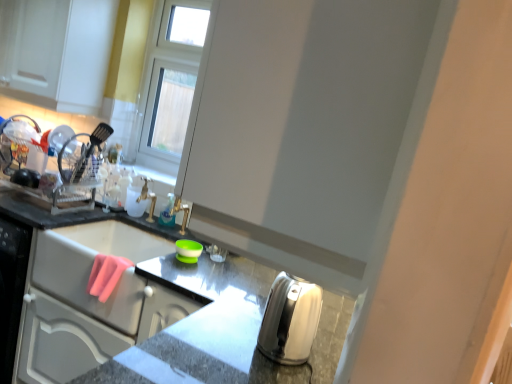
Question: Could you tell me if satin silver kettle at lower right, positioned as the 2th appliance in back-to-front order, is turned towards translucent plastic bottle at center?

Choices:
 (A) yes
 (B) no

Answer: (B)

Question: Is satin silver kettle at lower right, the 2th appliance from the left, further to the viewer compared to translucent plastic bottle at center?

Choices:
 (A) no
 (B) yes

Answer: (A)

Question: Is satin silver kettle at lower right, positioned as the 2th appliance in back-to-front order, shorter than translucent plastic bottle at center?

Choices:
 (A) no
 (B) yes

Answer: (A)

Question: Is satin silver kettle at lower right, the 2th appliance from the left, at the left side of translucent plastic bottle at center?

Choices:
 (A) yes
 (B) no

Answer: (B)

Question: Is satin silver kettle at lower right, the first appliance when ordered from front to back, with translucent plastic bottle at center?

Choices:
 (A) yes
 (B) no

Answer: (B)

Question: In the image, is translucent plastic bottle at center on the left side or the right side of white glossy sink at upper left?

Choices:
 (A) left
 (B) right

Answer: (B)

Question: Would you say translucent plastic bottle at center is inside or outside white glossy sink at upper left?

Choices:
 (A) inside
 (B) outside

Answer: (A)

Question: Considering the positions of point (170, 205) and point (135, 236), is point (170, 205) closer or farther from the camera than point (135, 236)?

Choices:
 (A) closer
 (B) farther

Answer: (B)

Question: From a real-world perspective, relative to white glossy sink at upper left, is translucent plastic bottle at center vertically above or below?

Choices:
 (A) below
 (B) above

Answer: (B)

Question: Based on their sizes in the image, would you say satin silver kettle at lower right, the first appliance when ordered from front to back, is bigger or smaller than satin silver toaster at lower right?

Choices:
 (A) small
 (B) big

Answer: (A)

Question: Considering the positions of point (290, 306) and point (186, 294), is point (290, 306) closer or farther from the camera than point (186, 294)?

Choices:
 (A) farther
 (B) closer

Answer: (B)

Question: Is satin silver kettle at lower right, the 2th appliance from the left, situated inside satin silver toaster at lower right or outside?

Choices:
 (A) outside
 (B) inside

Answer: (A)

Question: Based on their positions, is satin silver kettle at lower right, the first appliance when ordered from front to back, located to the left or right of satin silver toaster at lower right?

Choices:
 (A) right
 (B) left

Answer: (A)

Question: Would you say translucent plastic bottle at center is inside or outside satin silver kettle at lower right, placed as the 1th appliance when sorted from right to left?

Choices:
 (A) outside
 (B) inside

Answer: (A)

Question: From the image's perspective, is translucent plastic bottle at center located above or below satin silver kettle at lower right, placed as the 1th appliance when sorted from right to left?

Choices:
 (A) above
 (B) below

Answer: (A)